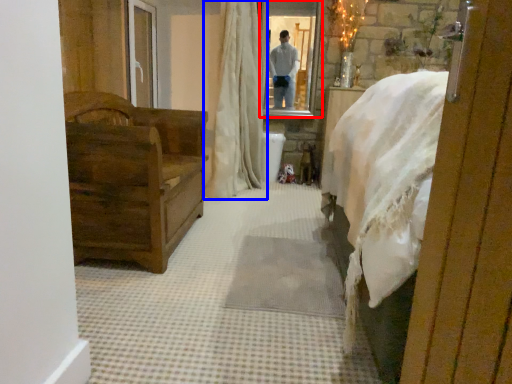
Question: Which of the following is the farthest to the observer, mirror (highlighted by a red box) or curtain (highlighted by a blue box)?

Choices:
 (A) mirror
 (B) curtain

Answer: (A)